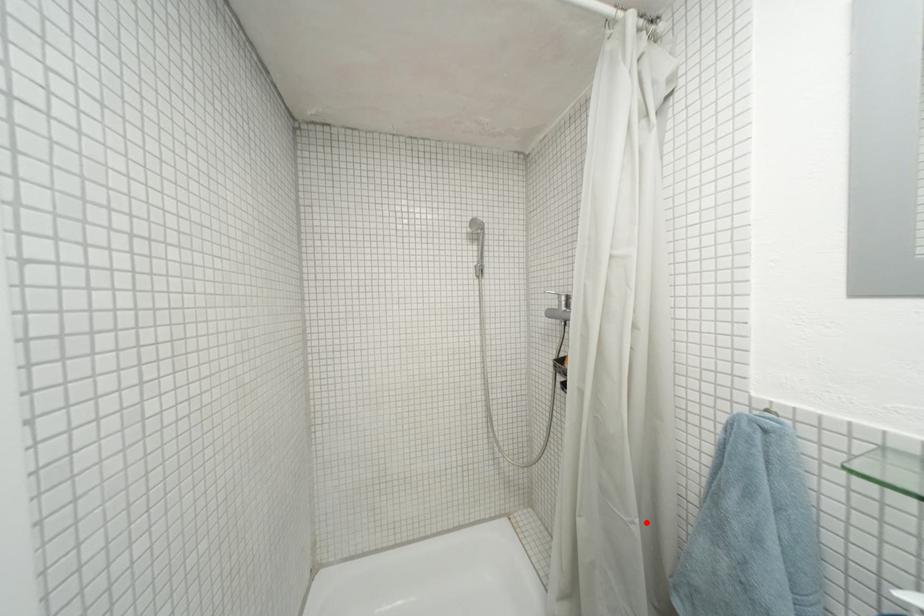
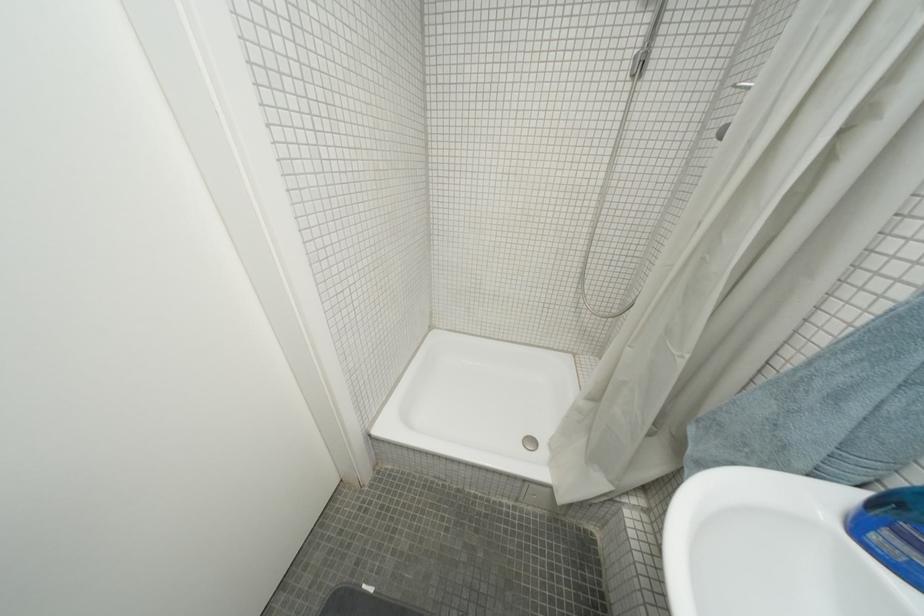
The point at the highlighted location is marked in the first image. Where is the corresponding point in the second image?

(697, 359)